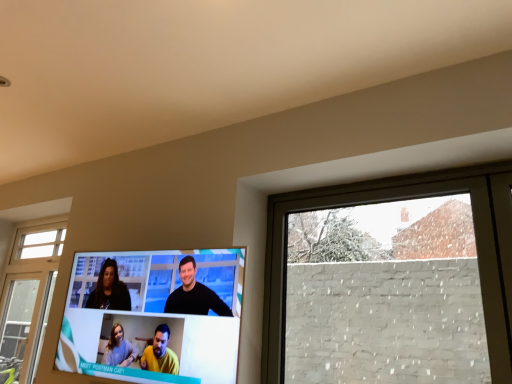
Question: Is white brick wall at right far away from matte black television at center?

Choices:
 (A) no
 (B) yes

Answer: (A)

Question: Does white brick wall at right have a greater height compared to matte black television at center?

Choices:
 (A) yes
 (B) no

Answer: (A)

Question: From the image's perspective, does white brick wall at right appear higher than matte black television at center?

Choices:
 (A) yes
 (B) no

Answer: (A)

Question: Considering the relative sizes of white brick wall at right and matte black television at center in the image provided, is white brick wall at right smaller than matte black television at center?

Choices:
 (A) no
 (B) yes

Answer: (B)

Question: From a real-world perspective, is white brick wall at right on matte black television at center?

Choices:
 (A) yes
 (B) no

Answer: (A)

Question: Considering the relative positions of white brick wall at right and matte black television at center in the image provided, is white brick wall at right to the right of matte black television at center from the viewer's perspective?

Choices:
 (A) yes
 (B) no

Answer: (A)

Question: Does matte black television at center have a greater height compared to white brick wall at right?

Choices:
 (A) no
 (B) yes

Answer: (A)

Question: From the image's perspective, is matte black television at center located above white brick wall at right?

Choices:
 (A) no
 (B) yes

Answer: (A)

Question: Can you confirm if matte black television at center is wider than white brick wall at right?

Choices:
 (A) yes
 (B) no

Answer: (A)

Question: From the image's perspective, would you say matte black television at center is shown under white brick wall at right?

Choices:
 (A) no
 (B) yes

Answer: (B)

Question: Is matte black television at center oriented away from white brick wall at right?

Choices:
 (A) no
 (B) yes

Answer: (A)

Question: Can you confirm if matte black television at center is smaller than white brick wall at right?

Choices:
 (A) yes
 (B) no

Answer: (B)

Question: Is point (509, 233) closer or farther from the camera than point (82, 332)?

Choices:
 (A) farther
 (B) closer

Answer: (B)